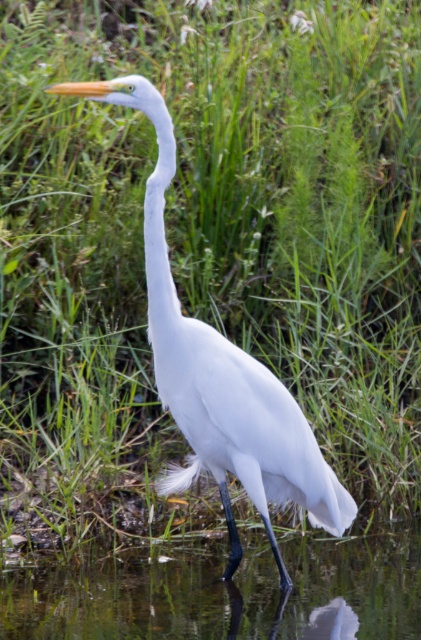
You are a photographer trying to capture the Great Egret in the image. You notice a point marked at coordinates point (226, 595). Based on the scene description, where is this point located relative to the Great Egret?

The point (226, 595) is on clear water at lower center, which means it is located on the reflective water surface near the center of the image, below the Great Egret.